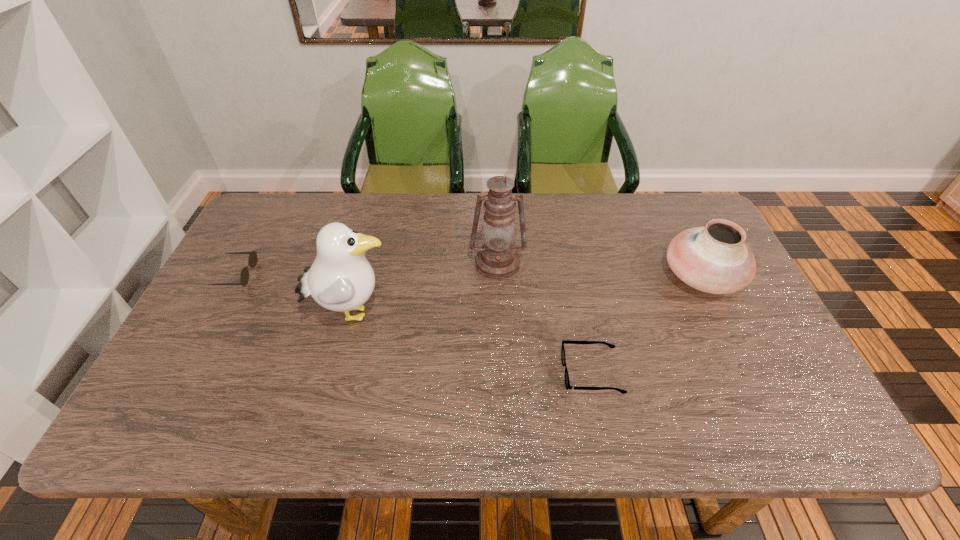
Find the location of a particular element. vacant area situated on the front-facing side of the sunglasses is located at coordinates (280, 274).

You are a GUI agent. You are given a task and a screenshot of the screen. Output one action in this format:
    pyautogui.click(x=<x>, y=<y>)
    Task: Click on the vacant region located on the arms of the spectacles
    This screenshot has width=960, height=540.
    Given the screenshot: What is the action you would take?
    pyautogui.click(x=411, y=373)

This screenshot has width=960, height=540. What are the coordinates of `blank area located on the arms of the spectacles` in the screenshot? It's located at (479, 373).

The height and width of the screenshot is (540, 960). I want to click on vacant space positioned on the arms of the spectacles, so pyautogui.click(x=441, y=373).

This screenshot has height=540, width=960. Find the location of `object located at the left edge`. object located at the left edge is located at coordinates (244, 277).

Identify the location of object located at the right edge. (714, 258).

In the image, there is a desktop. At what (x,y) coordinates should I click in order to perform the action: click on vacant space at the far edge. Please return your answer as a coordinate pair (x, y). Looking at the image, I should click on (644, 200).

Identify the location of vacant space at the near edge of the desktop. The image size is (960, 540). click(405, 429).

This screenshot has height=540, width=960. Identify the location of vacant region at the left edge of the desktop. (282, 256).

The height and width of the screenshot is (540, 960). Identify the location of vacant space at the right edge of the desktop. (750, 292).